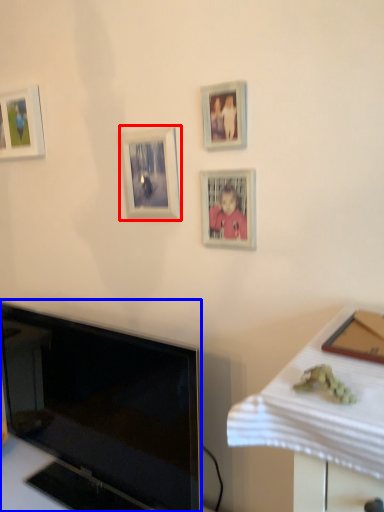
Question: Which point is closer to the camera, picture frame (highlighted by a red box) or television (highlighted by a blue box)?

Choices:
 (A) picture frame
 (B) television

Answer: (B)